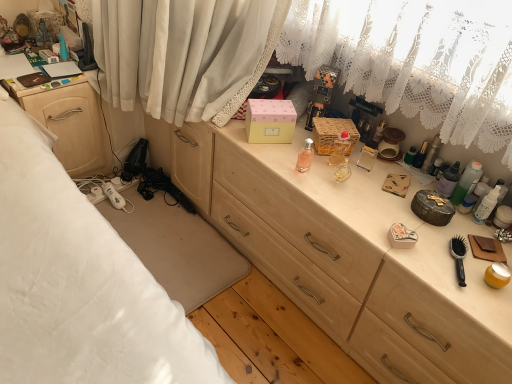
Locate an element on the screen. unoccupied space behind translucent plastic bottles at right, which ranks as the third toiletry in left-to-right order is located at coordinates (417, 168).